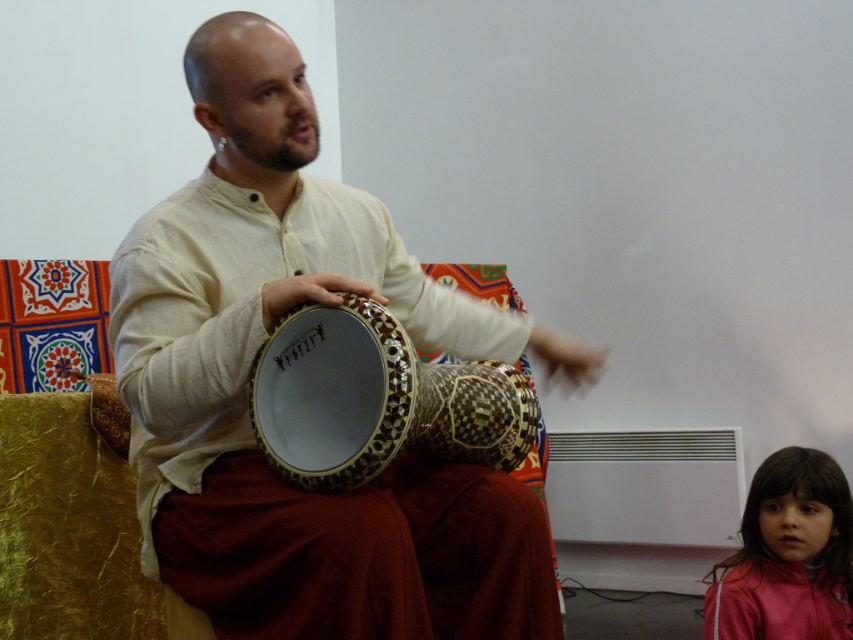
Can you confirm if matte wooden drum at center is shorter than wooden carved drum at center?

No, matte wooden drum at center is not shorter than wooden carved drum at center.

Who is more forward, (387, 564) or (421, 413)?

Positioned in front is point (387, 564).

Find the location of a particular element. The height and width of the screenshot is (640, 853). matte wooden drum at center is located at coordinates (247, 387).

Is matte wooden drum at center shorter than shiny pink jacket at lower right?

In fact, matte wooden drum at center may be taller than shiny pink jacket at lower right.

Does matte wooden drum at center have a larger size compared to shiny pink jacket at lower right?

Yes, matte wooden drum at center is bigger than shiny pink jacket at lower right.

You are a GUI agent. You are given a task and a screenshot of the screen. Output one action in this format:
    pyautogui.click(x=<x>, y=<y>)
    Task: Click on the matte wooden drum at center
    The width and height of the screenshot is (853, 640).
    Given the screenshot: What is the action you would take?
    pyautogui.click(x=247, y=387)

Image resolution: width=853 pixels, height=640 pixels. Find the location of `matte wooden drum at center`. matte wooden drum at center is located at coordinates (247, 387).

Is wooden carved drum at center closer to the viewer compared to shiny pink jacket at lower right?

Yes, wooden carved drum at center is closer to the viewer.

Is wooden carved drum at center below shiny pink jacket at lower right?

Incorrect, wooden carved drum at center is not positioned below shiny pink jacket at lower right.

Describe the element at coordinates (376, 401) in the screenshot. I see `wooden carved drum at center` at that location.

You are a GUI agent. You are given a task and a screenshot of the screen. Output one action in this format:
    pyautogui.click(x=<x>, y=<y>)
    Task: Click on the wooden carved drum at center
    
    Given the screenshot: What is the action you would take?
    (376, 401)